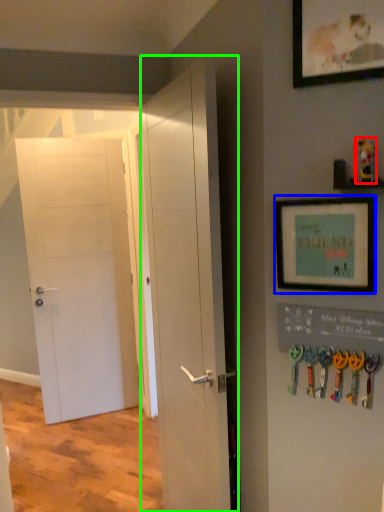
Question: Which is farther away from toy (highlighted by a red box)? picture frame (highlighted by a blue box) or door (highlighted by a green box)?

Choices:
 (A) picture frame
 (B) door

Answer: (B)